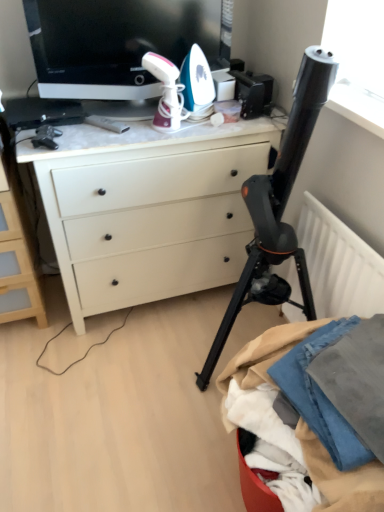
Question: Is white matte desk at center taller or shorter than black glossy television at upper center?

Choices:
 (A) tall
 (B) short

Answer: (A)

Question: In terms of size, does white matte desk at center appear bigger or smaller than black glossy television at upper center?

Choices:
 (A) small
 (B) big

Answer: (B)

Question: Which of these objects is positioned closest to the denim fabric at lower right?

Choices:
 (A) white matte chest of drawers at left
 (B) white matte desk at center
 (C) black matte tripod at center
 (D) white matte radiator at right
 (E) black glossy television at upper center

Answer: (D)

Question: Which of these objects is positioned closest to the denim fabric at lower right?

Choices:
 (A) black matte tripod at center
 (B) white matte chest of drawers at left
 (C) white matte radiator at right
 (D) white matte desk at center
 (E) black glossy television at upper center

Answer: (C)